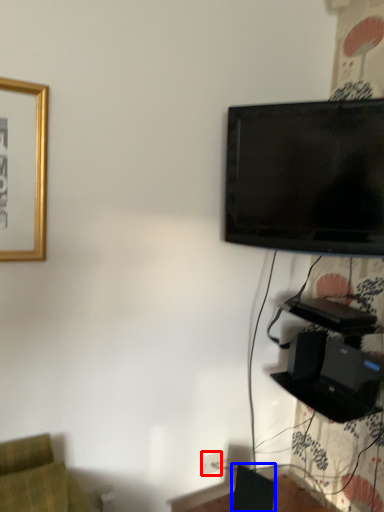
Question: Among these objects, which one is nearest to the camera, electric outlet (highlighted by a red box) or speaker (highlighted by a blue box)?

Choices:
 (A) electric outlet
 (B) speaker

Answer: (B)